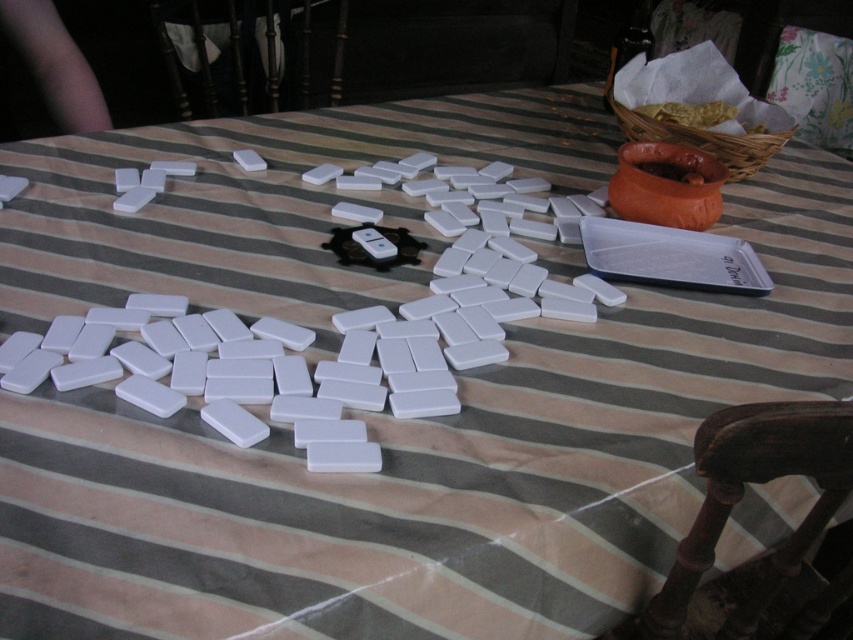
Is white matte dominoes at center further to the viewer compared to brown wooden chair at lower right?

Yes, it is.

Does point (364, 470) come behind point (819, 406)?

That is True.

Locate an element on the screen. The height and width of the screenshot is (640, 853). white matte dominoes at center is located at coordinates click(x=303, y=349).

Is white matte dominoes at center positioned in front of black metal chair at upper left?

Yes, white matte dominoes at center is in front of black metal chair at upper left.

Between white matte dominoes at center and black metal chair at upper left, which one is positioned higher?

Positioned higher is black metal chair at upper left.

Is point (154, 362) less distant than point (181, 26)?

Yes, point (154, 362) is closer to viewer.

Where is `white matte dominoes at center`? The height and width of the screenshot is (640, 853). white matte dominoes at center is located at coordinates (303, 349).

Image resolution: width=853 pixels, height=640 pixels. Describe the element at coordinates (741, 497) in the screenshot. I see `brown wooden chair at lower right` at that location.

How much distance is there between brown wooden chair at lower right and black metal chair at upper left?

brown wooden chair at lower right is 5.42 feet away from black metal chair at upper left.

Between point (669, 602) and point (294, 76), which one is positioned behind?

The point (294, 76) is behind.

I want to click on brown wooden chair at lower right, so click(x=741, y=497).